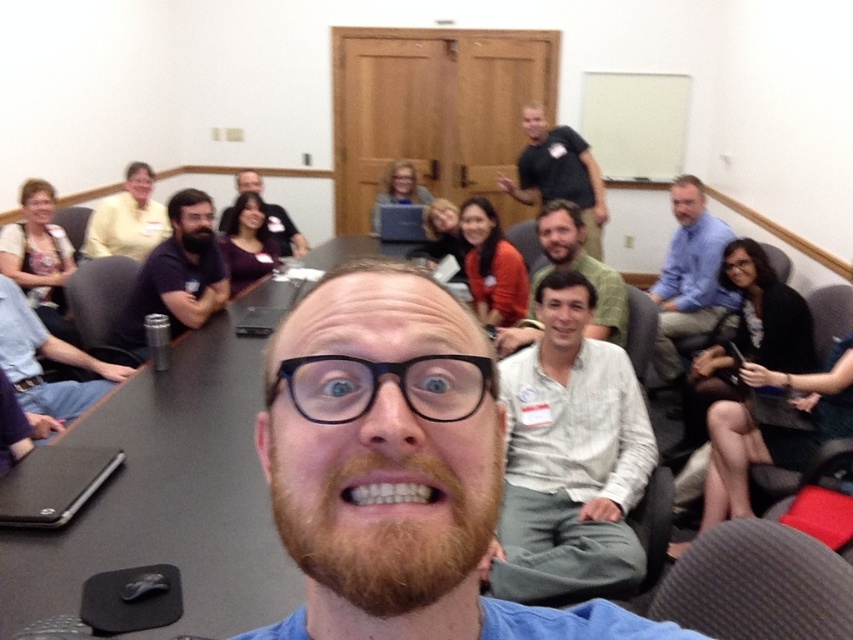
You are standing at the entrance of the room and see the bearded man at center and the matte yellow shirt at upper left. Which object is closer to the entrance?

The matte yellow shirt at upper left is closer to the entrance because the bearded man at center is to the right of it, meaning it is positioned between the entrance and the bearded man.